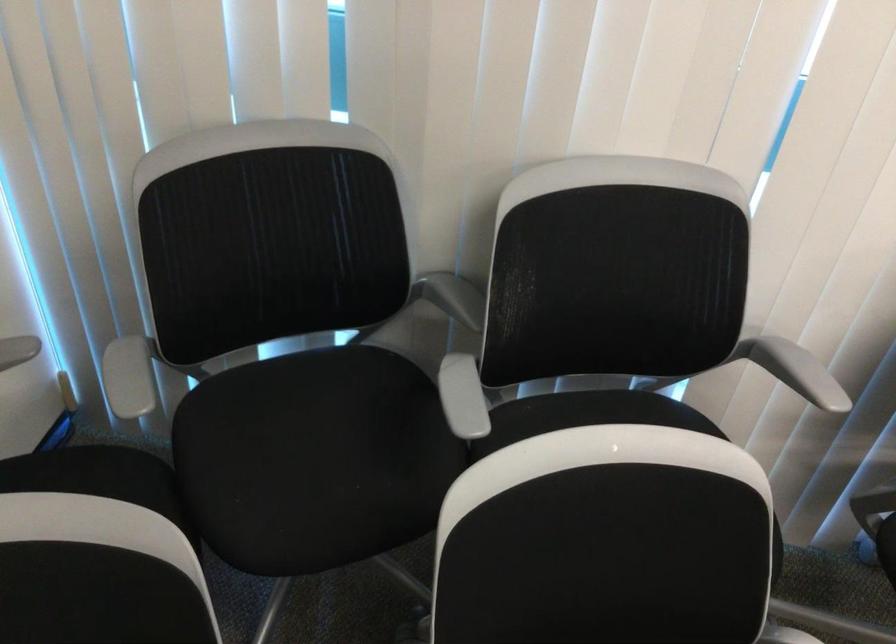
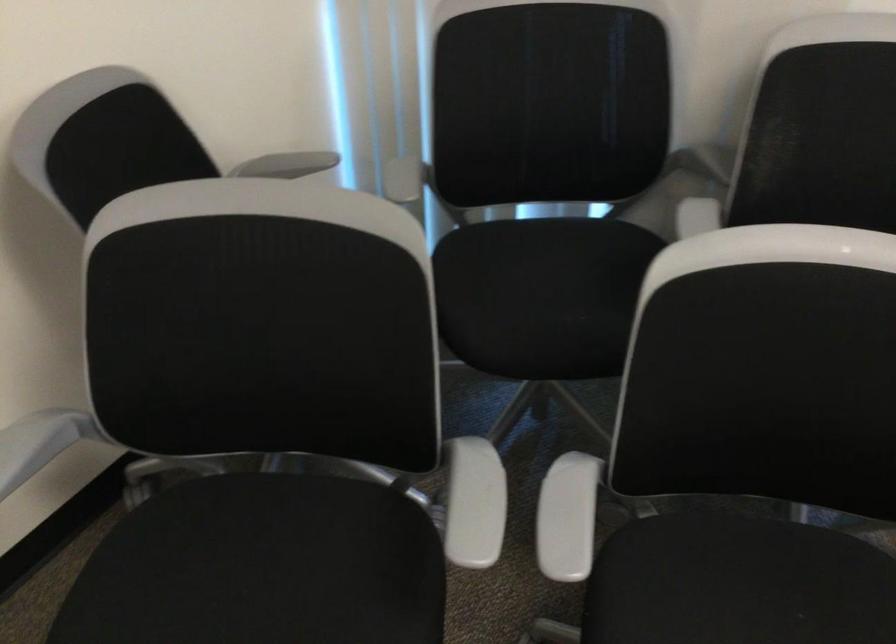
Question: How did the camera likely rotate?

Choices:
 (A) Left
 (B) Right
 (C) Up
 (D) Down

Answer: (A)